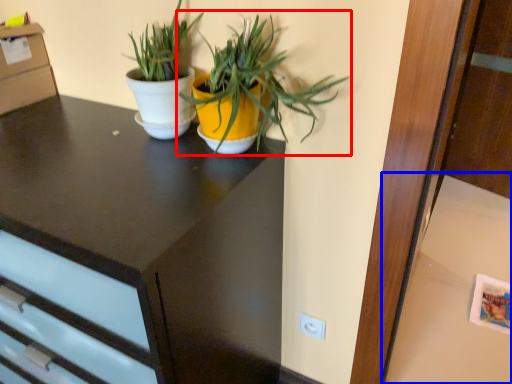
Question: Which object is closer to the camera taking this photo, houseplant (highlighted by a red box) or table (highlighted by a blue box)?

Choices:
 (A) houseplant
 (B) table

Answer: (A)